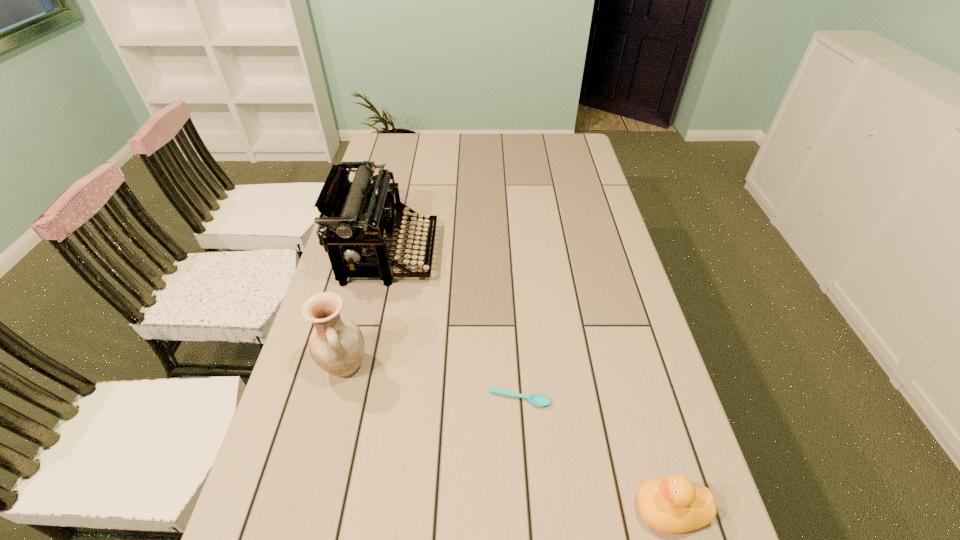
Identify the location of typewriter. This screenshot has width=960, height=540. coord(356,216).

Where is `the third nearest object`? This screenshot has height=540, width=960. the third nearest object is located at coordinates (336, 344).

In order to click on pottery in this screenshot , I will do `click(336, 344)`.

Find the location of a particular element. duck is located at coordinates (673, 505).

Identify the location of the rightmost object. coord(673,505).

Where is `the second object from right to left`? the second object from right to left is located at coordinates (537, 399).

This screenshot has width=960, height=540. Identify the location of the shortest object. (537, 399).

You are a GUI agent. You are given a task and a screenshot of the screen. Output one action in this format:
    pyautogui.click(x=<x>, y=<y>)
    Task: Click on the free spot located 0.360m on the typing side of the typewriter
    This screenshot has height=540, width=960.
    Given the screenshot: What is the action you would take?
    pyautogui.click(x=549, y=253)

This screenshot has height=540, width=960. What are the coordinates of `vacant space located 0.390m on the right of the pottery` in the screenshot? It's located at (526, 366).

Identify the location of vacant space located 0.310m on the face of the second shortest object. This screenshot has height=540, width=960. (476, 509).